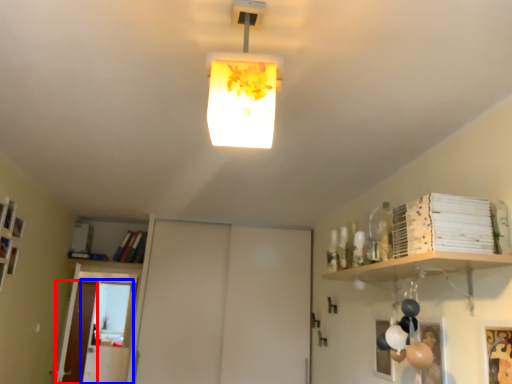
Question: Which object is further to the camera taking this photo, door (highlighted by a red box) or glass door (highlighted by a blue box)?

Choices:
 (A) door
 (B) glass door

Answer: (A)